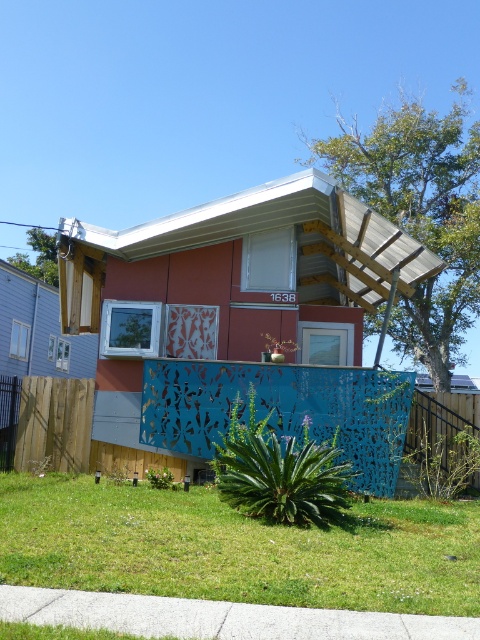
You are a gardener who wants to trim the green grass at lower center so it reaches the height of the blue perforated metal fence at lower center. How much taller does the grass need to grow?

The green grass at lower center is currently shorter than the blue perforated metal fence at lower center. To reach the fence height, the grass needs to grow taller by the difference between their current heights.

You are standing in front of the residential building and want to walk towards the green grass at lower center. Which direction should you move relative to the blue perforated metal fence at lower center?

The green grass at lower center is positioned on the left side of the blue perforated metal fence at lower center. Therefore, you should move to the left side of the blue perforated metal fence at lower center to reach the green grass at lower center.

You are standing in front of the residential building and want to place a small garden ornament. The ornament requires a space at point coordinates between 0.8 and 0.5 on both axes. Can the green grass at lower center accommodate this ornament?

The green grass at lower center is located at point coordinates 0.858 and 0.494, which falls within the required range of 0.8 to 0.5 on both axes. Therefore, the green grass at lower center can accommodate the ornament.